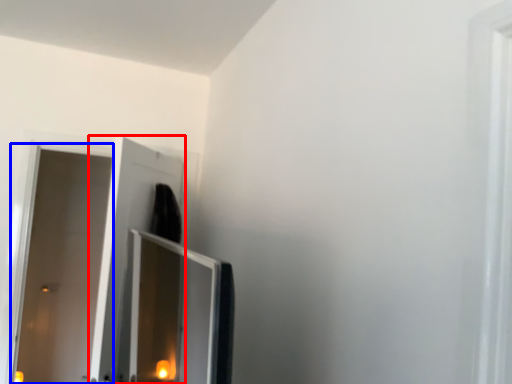
Question: Which point is further to the camera, screen door (highlighted by a red box) or door (highlighted by a blue box)?

Choices:
 (A) screen door
 (B) door

Answer: (B)